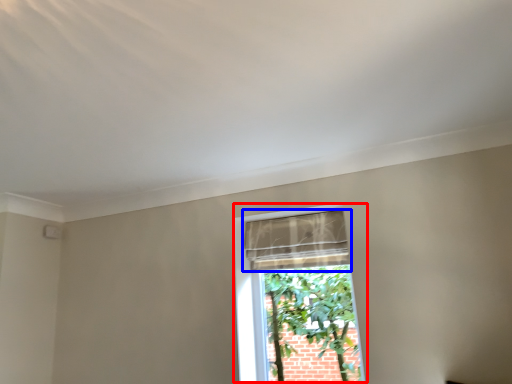
Question: Which object appears closest to the camera in this image, window (highlighted by a red box) or curtain (highlighted by a blue box)?

Choices:
 (A) window
 (B) curtain

Answer: (A)